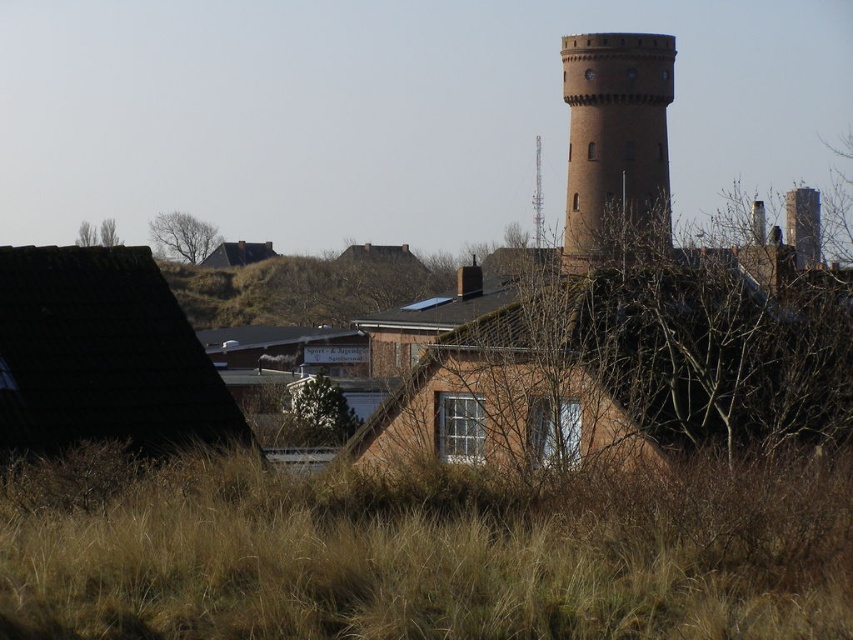
Question: Which point is farther to the camera?

Choices:
 (A) (651, 61)
 (B) (317, 387)

Answer: (A)

Question: Which object appears closest to the camera in this image?

Choices:
 (A) brown leafless tree at left
 (B) brown brick tower at upper center

Answer: (B)

Question: Does bare branches at upper left appear under matte brown chimney at upper center?

Choices:
 (A) no
 (B) yes

Answer: (A)

Question: Which point is farther to the camera?

Choices:
 (A) (117, 240)
 (B) (805, 209)
 (C) (624, 508)

Answer: (A)

Question: Can you confirm if bare branches at upper left is thinner than green leafy tree at upper left?

Choices:
 (A) no
 (B) yes

Answer: (B)

Question: Does bare branches at upper left have a greater width compared to brown brick tower at upper center?

Choices:
 (A) no
 (B) yes

Answer: (A)